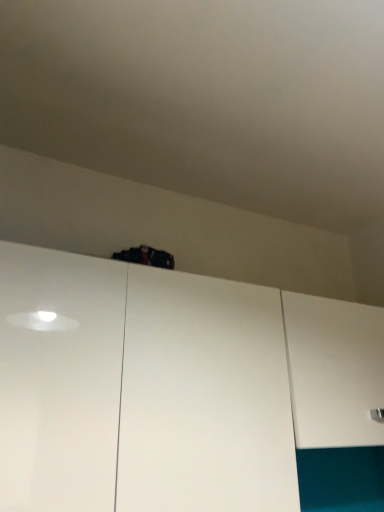
The width and height of the screenshot is (384, 512). Describe the element at coordinates (182, 391) in the screenshot. I see `white matte cabinet at upper center, which is the 1th cabinetry from left to right` at that location.

At what (x,y) coordinates should I click in order to perform the action: click on white matte cabinet at upper center, the second cabinetry in the right-to-left sequence. Please return your answer as a coordinate pair (x, y). Looking at the image, I should click on (182, 391).

Where is `white matte cabinet at center, which appears as the 2th cabinetry when viewed from the left`? Image resolution: width=384 pixels, height=512 pixels. white matte cabinet at center, which appears as the 2th cabinetry when viewed from the left is located at coordinates (334, 370).

The height and width of the screenshot is (512, 384). What do you see at coordinates (334, 370) in the screenshot?
I see `white matte cabinet at center, which appears as the 2th cabinetry when viewed from the left` at bounding box center [334, 370].

How much space does white matte cabinet at center, which appears as the 2th cabinetry when viewed from the left, occupy vertically?

white matte cabinet at center, which appears as the 2th cabinetry when viewed from the left, is 13.92 inches in height.

In order to click on white matte cabinet at upper center, the second cabinetry in the right-to-left sequence in this screenshot , I will do `click(182, 391)`.

From the picture: Considering the relative positions of white matte cabinet at upper center, which is the 1th cabinetry from left to right, and white matte cabinet at center, arranged as the first cabinetry when viewed from the right, in the image provided, is white matte cabinet at upper center, which is the 1th cabinetry from left to right, to the right of white matte cabinet at center, arranged as the first cabinetry when viewed from the right, from the viewer's perspective?

Incorrect, white matte cabinet at upper center, which is the 1th cabinetry from left to right, is not on the right side of white matte cabinet at center, arranged as the first cabinetry when viewed from the right.

Is white matte cabinet at upper center, which is the 1th cabinetry from left to right, in front of or behind white matte cabinet at center, which appears as the 2th cabinetry when viewed from the left, in the image?

white matte cabinet at upper center, which is the 1th cabinetry from left to right, is in front of white matte cabinet at center, which appears as the 2th cabinetry when viewed from the left.

Does point (343, 441) lie in front of point (334, 385)?

Yes, point (343, 441) is in front of point (334, 385).

From the image's perspective, between white matte cabinet at upper center, which is the 1th cabinetry from left to right, and white matte cabinet at center, arranged as the first cabinetry when viewed from the right, which one is located above?

white matte cabinet at upper center, which is the 1th cabinetry from left to right, appears higher in the image.

From a real-world perspective, is white matte cabinet at upper center, which is the 1th cabinetry from left to right, positioned above or below white matte cabinet at center, which appears as the 2th cabinetry when viewed from the left?

In terms of real-world spatial position, white matte cabinet at upper center, which is the 1th cabinetry from left to right, is below white matte cabinet at center, which appears as the 2th cabinetry when viewed from the left.

In the scene shown: Does white matte cabinet at upper center, the second cabinetry in the right-to-left sequence, have a greater width compared to white matte cabinet at center, which appears as the 2th cabinetry when viewed from the left?

No.

Based on the photo, who is taller, white matte cabinet at upper center, the second cabinetry in the right-to-left sequence, or white matte cabinet at center, which appears as the 2th cabinetry when viewed from the left?

Standing taller between the two is white matte cabinet at upper center, the second cabinetry in the right-to-left sequence.

Considering the sizes of white matte cabinet at upper center, the second cabinetry in the right-to-left sequence, and white matte cabinet at center, which appears as the 2th cabinetry when viewed from the left, in the image, is white matte cabinet at upper center, the second cabinetry in the right-to-left sequence, bigger or smaller than white matte cabinet at center, which appears as the 2th cabinetry when viewed from the left,?

Clearly, white matte cabinet at upper center, the second cabinetry in the right-to-left sequence, is larger in size than white matte cabinet at center, which appears as the 2th cabinetry when viewed from the left.

Based on the photo, is white matte cabinet at upper center, the second cabinetry in the right-to-left sequence, spatially inside white matte cabinet at center, which appears as the 2th cabinetry when viewed from the left, or outside of it?

white matte cabinet at upper center, the second cabinetry in the right-to-left sequence, is outside white matte cabinet at center, which appears as the 2th cabinetry when viewed from the left.

Is white matte cabinet at upper center, the second cabinetry in the right-to-left sequence, not near white matte cabinet at center, which appears as the 2th cabinetry when viewed from the left?

That's not correct — white matte cabinet at upper center, the second cabinetry in the right-to-left sequence, is a little close to white matte cabinet at center, which appears as the 2th cabinetry when viewed from the left.

Is white matte cabinet at upper center, which is the 1th cabinetry from left to right, aimed at white matte cabinet at center, arranged as the first cabinetry when viewed from the right?

No, white matte cabinet at upper center, which is the 1th cabinetry from left to right, is not facing towards white matte cabinet at center, arranged as the first cabinetry when viewed from the right.

What's the angular difference between white matte cabinet at upper center, the second cabinetry in the right-to-left sequence, and white matte cabinet at center, arranged as the first cabinetry when viewed from the right,'s facing directions?

white matte cabinet at upper center, the second cabinetry in the right-to-left sequence, and white matte cabinet at center, arranged as the first cabinetry when viewed from the right, are facing 0.0014 degrees away from each other.

Where is `cabinetry to the right of white matte cabinet at upper center, the second cabinetry in the right-to-left sequence`? cabinetry to the right of white matte cabinet at upper center, the second cabinetry in the right-to-left sequence is located at coordinates coord(334,370).

Looking at this image, would you say white matte cabinet at center, which appears as the 2th cabinetry when viewed from the left, is to the left or to the right of white matte cabinet at upper center, the second cabinetry in the right-to-left sequence, in the picture?

Clearly, white matte cabinet at center, which appears as the 2th cabinetry when viewed from the left, is on the right of white matte cabinet at upper center, the second cabinetry in the right-to-left sequence, in the image.

Which is in front, white matte cabinet at center, arranged as the first cabinetry when viewed from the right, or white matte cabinet at upper center, which is the 1th cabinetry from left to right?

white matte cabinet at upper center, which is the 1th cabinetry from left to right.

Does point (342, 345) come farther from viewer compared to point (242, 314)?

Yes, point (342, 345) is farther from viewer.

From the image's perspective, is white matte cabinet at center, which appears as the 2th cabinetry when viewed from the left, above or below white matte cabinet at upper center, which is the 1th cabinetry from left to right?

white matte cabinet at center, which appears as the 2th cabinetry when viewed from the left, is below white matte cabinet at upper center, which is the 1th cabinetry from left to right.

From a real-world perspective, is white matte cabinet at center, which appears as the 2th cabinetry when viewed from the left, on white matte cabinet at upper center, which is the 1th cabinetry from left to right?

Yes.

Considering the relative sizes of white matte cabinet at center, which appears as the 2th cabinetry when viewed from the left, and white matte cabinet at upper center, the second cabinetry in the right-to-left sequence, in the image provided, is white matte cabinet at center, which appears as the 2th cabinetry when viewed from the left, wider than white matte cabinet at upper center, the second cabinetry in the right-to-left sequence,?

Yes, white matte cabinet at center, which appears as the 2th cabinetry when viewed from the left, is wider than white matte cabinet at upper center, the second cabinetry in the right-to-left sequence.

Which of these two, white matte cabinet at center, which appears as the 2th cabinetry when viewed from the left, or white matte cabinet at upper center, which is the 1th cabinetry from left to right, stands taller?

With more height is white matte cabinet at upper center, which is the 1th cabinetry from left to right.

Considering the relative sizes of white matte cabinet at center, arranged as the first cabinetry when viewed from the right, and white matte cabinet at upper center, which is the 1th cabinetry from left to right, in the image provided, is white matte cabinet at center, arranged as the first cabinetry when viewed from the right, bigger than white matte cabinet at upper center, which is the 1th cabinetry from left to right,?

No, white matte cabinet at center, arranged as the first cabinetry when viewed from the right, is not bigger than white matte cabinet at upper center, which is the 1th cabinetry from left to right.

Is white matte cabinet at center, which appears as the 2th cabinetry when viewed from the left, outside of white matte cabinet at upper center, which is the 1th cabinetry from left to right?

That's correct, white matte cabinet at center, which appears as the 2th cabinetry when viewed from the left, is outside of white matte cabinet at upper center, which is the 1th cabinetry from left to right.

Is white matte cabinet at center, arranged as the first cabinetry when viewed from the right, far from white matte cabinet at upper center, which is the 1th cabinetry from left to right?

No.

Is white matte cabinet at center, which appears as the 2th cabinetry when viewed from the left, looking in the opposite direction of white matte cabinet at upper center, which is the 1th cabinetry from left to right?

No, white matte cabinet at center, which appears as the 2th cabinetry when viewed from the left, is not facing away from white matte cabinet at upper center, which is the 1th cabinetry from left to right.

How many degrees apart are the facing directions of white matte cabinet at center, arranged as the first cabinetry when viewed from the right, and white matte cabinet at upper center, which is the 1th cabinetry from left to right?

white matte cabinet at center, arranged as the first cabinetry when viewed from the right, and white matte cabinet at upper center, which is the 1th cabinetry from left to right, are facing 0.0014 degrees away from each other.

Measure the distance from white matte cabinet at center, which appears as the 2th cabinetry when viewed from the left, to white matte cabinet at upper center, the second cabinetry in the right-to-left sequence.

white matte cabinet at center, which appears as the 2th cabinetry when viewed from the left, is 3.98 inches away from white matte cabinet at upper center, the second cabinetry in the right-to-left sequence.

What are the coordinates of `cabinetry lying above the white matte cabinet at center, which appears as the 2th cabinetry when viewed from the left (from the image's perspective)` in the screenshot? It's located at (182, 391).

This screenshot has height=512, width=384. I want to click on cabinetry above the white matte cabinet at center, which appears as the 2th cabinetry when viewed from the left (from the image's perspective), so click(x=182, y=391).

The width and height of the screenshot is (384, 512). There is a white matte cabinet at upper center, the second cabinetry in the right-to-left sequence. In order to click on cabinetry above it (from a real-world perspective) in this screenshot , I will do `click(334, 370)`.